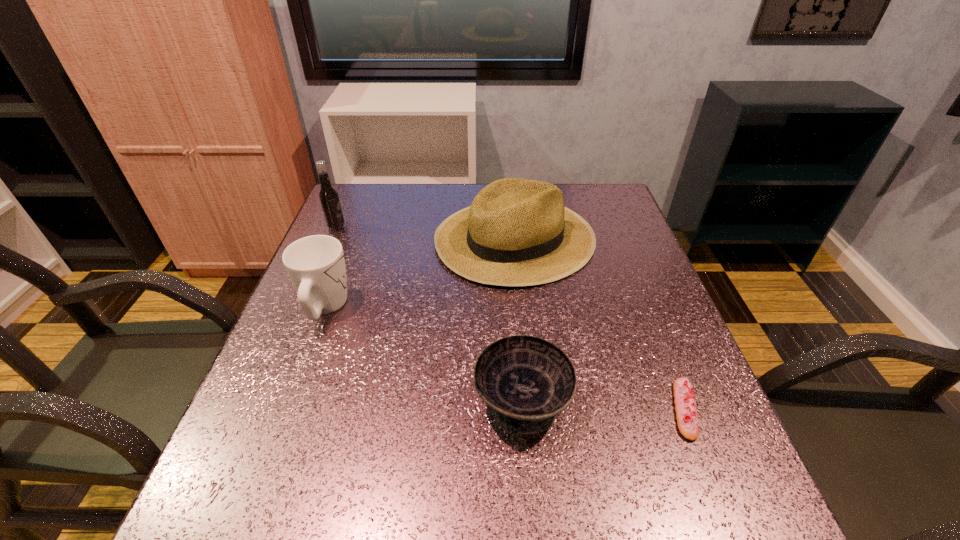
The height and width of the screenshot is (540, 960). Identify the location of free space located 0.370m on the side of the mug with the handle. (365, 201).

Where is `free location located 0.150m on the right of the second shortest object`? This screenshot has width=960, height=540. free location located 0.150m on the right of the second shortest object is located at coordinates (653, 401).

Locate an element on the screen. vacant point located 0.180m on the left of the rightmost object is located at coordinates (569, 409).

Locate an element on the screen. root beer that is at the far edge is located at coordinates (328, 196).

At what (x,y) coordinates should I click in order to perform the action: click on sunhat situated at the far edge. Please return your answer as a coordinate pair (x, y). The image size is (960, 540). Looking at the image, I should click on (517, 232).

This screenshot has height=540, width=960. In order to click on root beer that is at the left edge in this screenshot , I will do `click(328, 196)`.

You are a GUI agent. You are given a task and a screenshot of the screen. Output one action in this format:
    pyautogui.click(x=<x>, y=<y>)
    Task: Click on the mug present at the left edge
    
    Given the screenshot: What is the action you would take?
    pyautogui.click(x=315, y=264)

The image size is (960, 540). Identify the location of sunhat located in the right edge section of the desktop. (517, 232).

The image size is (960, 540). Identify the location of eclair at the right edge. (685, 404).

I want to click on object at the far left corner, so click(328, 196).